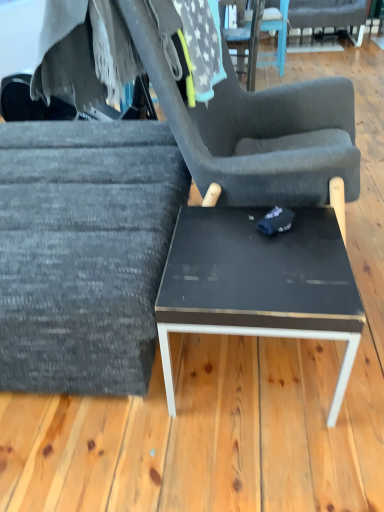
Question: Is textured gray fabric chair at left, the 1th chair when ordered from bottom to top, turned away from fuzzy gray blanket at upper left?

Choices:
 (A) no
 (B) yes

Answer: (A)

Question: Is textured gray fabric chair at left, the third chair positioned from the top, at the left side of fuzzy gray blanket at upper left?

Choices:
 (A) no
 (B) yes

Answer: (B)

Question: From the image's perspective, is textured gray fabric chair at left, the 1th chair when ordered from bottom to top, under fuzzy gray blanket at upper left?

Choices:
 (A) no
 (B) yes

Answer: (B)

Question: From a real-world perspective, is textured gray fabric chair at left, the third chair positioned from the top, on top of fuzzy gray blanket at upper left?

Choices:
 (A) no
 (B) yes

Answer: (A)

Question: Considering the relative sizes of textured gray fabric chair at left, the third chair from the right, and fuzzy gray blanket at upper left in the image provided, is textured gray fabric chair at left, the third chair from the right, thinner than fuzzy gray blanket at upper left?

Choices:
 (A) yes
 (B) no

Answer: (B)

Question: Is point tap(357, 3) positioned closer to the camera than point tap(221, 309)?

Choices:
 (A) farther
 (B) closer

Answer: (A)

Question: Considering the positions of dark gray fabric chair at upper right, the third chair positioned from the bottom, and black glossy table at center in the image, is dark gray fabric chair at upper right, the third chair positioned from the bottom, wider or thinner than black glossy table at center?

Choices:
 (A) thin
 (B) wide

Answer: (B)

Question: From the image's perspective, is dark gray fabric chair at upper right, placed as the first chair when sorted from back to front, located above or below black glossy table at center?

Choices:
 (A) below
 (B) above

Answer: (B)

Question: Relative to black glossy table at center, is dark gray fabric chair at upper right, which is the third chair in front-to-back order, in front or behind?

Choices:
 (A) behind
 (B) front

Answer: (A)

Question: From the image's perspective, is textured gray fabric chair at center, the second chair when ordered from right to left, positioned above or below textured gray fabric chair at left, the third chair positioned from the top?

Choices:
 (A) above
 (B) below

Answer: (A)

Question: Considering the positions of textured gray fabric chair at center, positioned as the 2th chair in front-to-back order, and textured gray fabric chair at left, which is counted as the third chair, starting from the back, in the image, is textured gray fabric chair at center, positioned as the 2th chair in front-to-back order, wider or thinner than textured gray fabric chair at left, which is counted as the third chair, starting from the back,?

Choices:
 (A) wide
 (B) thin

Answer: (B)

Question: Considering the relative positions of textured gray fabric chair at center, the second chair when ordered from right to left, and textured gray fabric chair at left, the third chair from the right, in the image provided, is textured gray fabric chair at center, the second chair when ordered from right to left, to the left or to the right of textured gray fabric chair at left, the third chair from the right,?

Choices:
 (A) right
 (B) left

Answer: (A)

Question: Looking at the image, does textured gray fabric chair at center, marked as the 2th chair in a left-to-right arrangement, seem bigger or smaller compared to textured gray fabric chair at left, the first chair in the front-to-back sequence?

Choices:
 (A) small
 (B) big

Answer: (A)

Question: From a real-world perspective, is textured gray fabric chair at center, marked as the 2th chair in a left-to-right arrangement, positioned above or below fuzzy gray blanket at upper left?

Choices:
 (A) below
 (B) above

Answer: (A)

Question: In terms of width, does textured gray fabric chair at center, acting as the 2th chair starting from the top, look wider or thinner when compared to fuzzy gray blanket at upper left?

Choices:
 (A) thin
 (B) wide

Answer: (B)